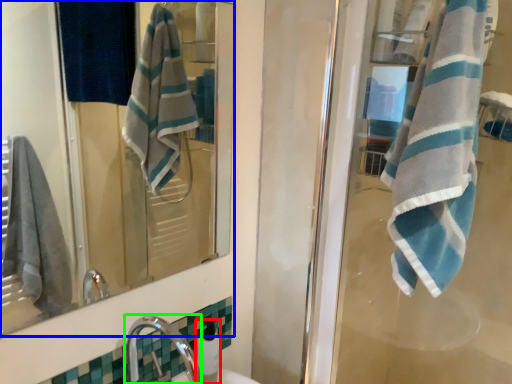
Question: Based on their relative distances, which object is nearer to soap dispenser (highlighted by a red box)? Choose from mirror (highlighted by a blue box) and faucet (highlighted by a green box).

Choices:
 (A) mirror
 (B) faucet

Answer: (B)